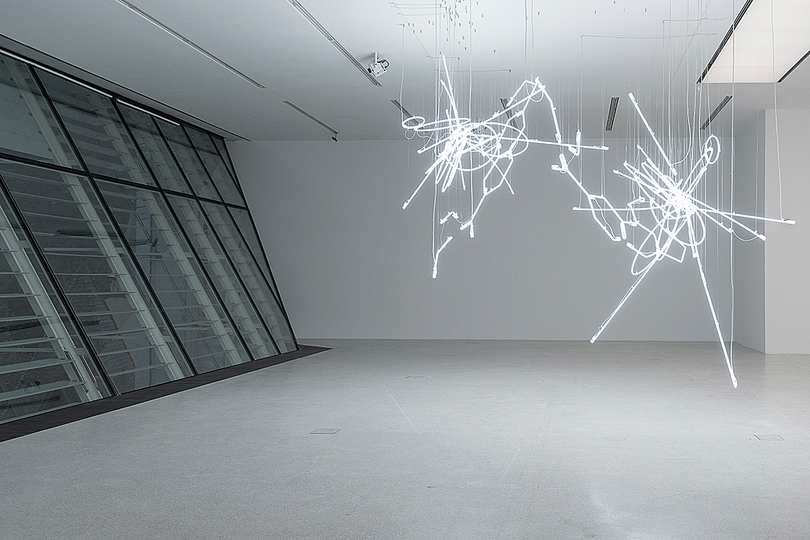
Where is `apparatus affixed to ceiling`? apparatus affixed to ceiling is located at coordinates (377, 68).